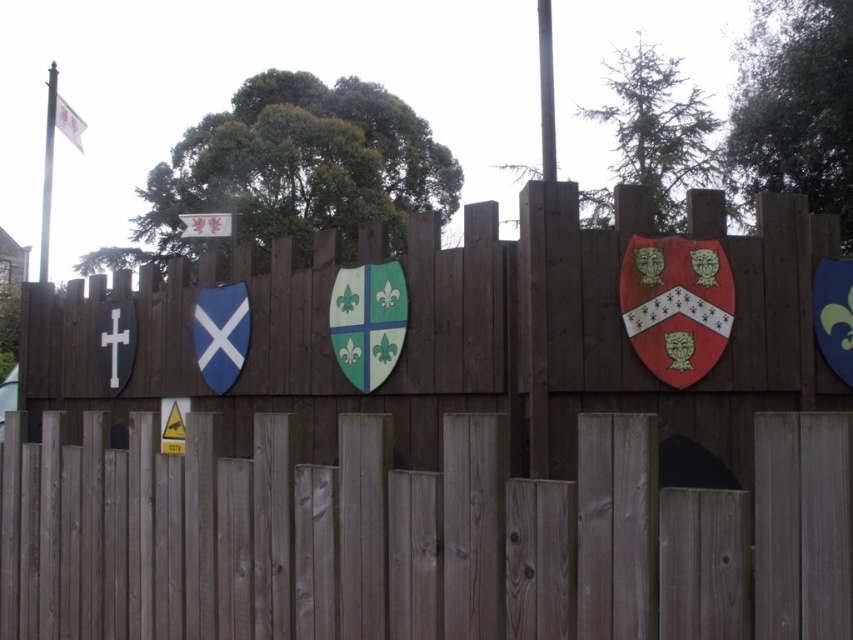
Question: Among these objects, which one is nearest to the camera?

Choices:
 (A) white paper flag at upper left
 (B) green matte shield at center
 (C) metallic flagpole at upper left
 (D) silver metallic pole at center

Answer: (D)

Question: Considering the real-world distances, which object is closest to the white paper flag at upper left?

Choices:
 (A) metallic flagpole at upper left
 (B) red glossy shield at center
 (C) brown wooden fence at center
 (D) silver metallic pole at center

Answer: (C)

Question: Is green matte shield at center above white paper flag at upper left?

Choices:
 (A) no
 (B) yes

Answer: (A)

Question: Which point is closer to the camera?

Choices:
 (A) (148, 380)
 (B) (86, 125)
 (C) (538, 36)
 (D) (641, 332)

Answer: (D)

Question: Is brown wooden fence at center positioned in front of metallic flagpole at upper left?

Choices:
 (A) yes
 (B) no

Answer: (A)

Question: Is red glossy shield at center further to the viewer compared to green matte shield at center?

Choices:
 (A) no
 (B) yes

Answer: (A)